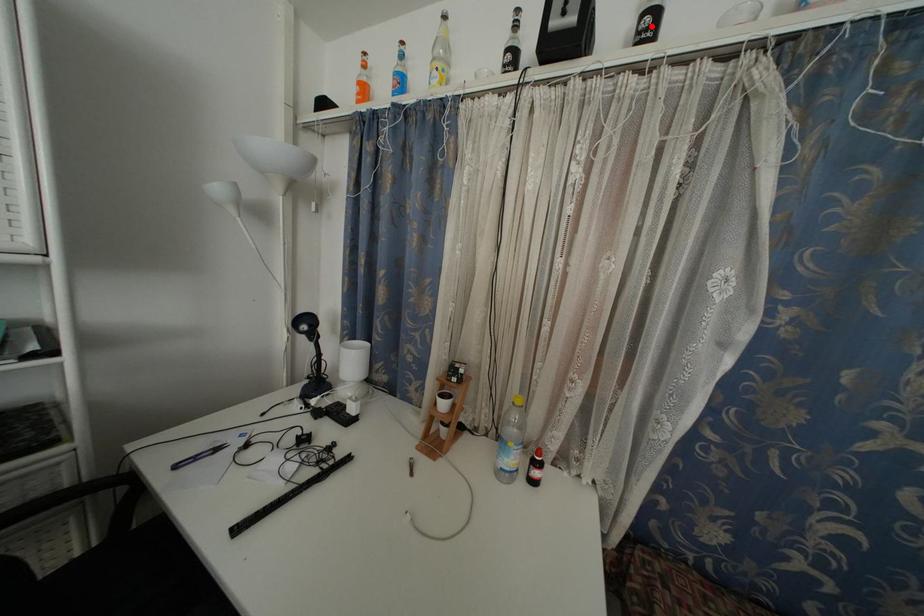
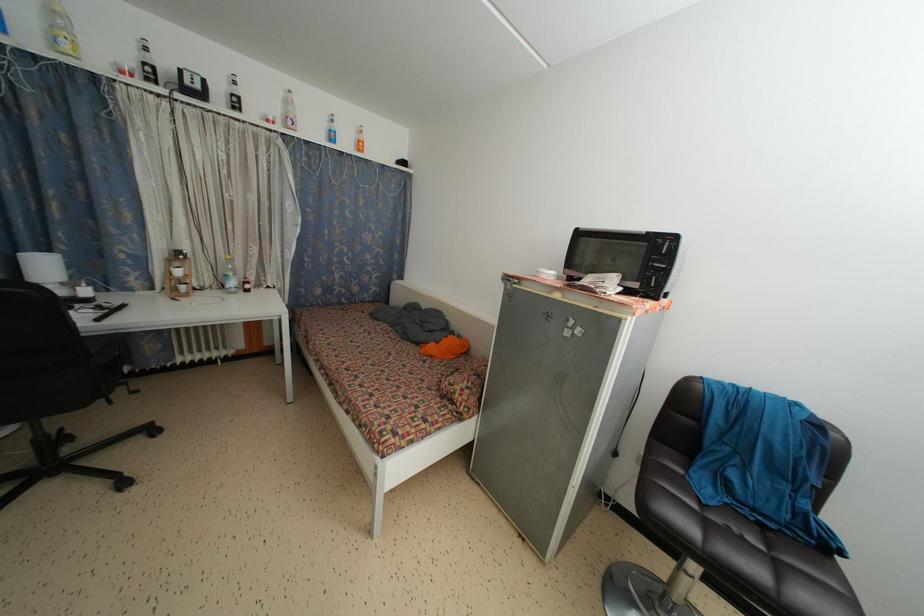
The point at the highlighted location is marked in the first image. Where is the corresponding point in the second image?

(238, 105)